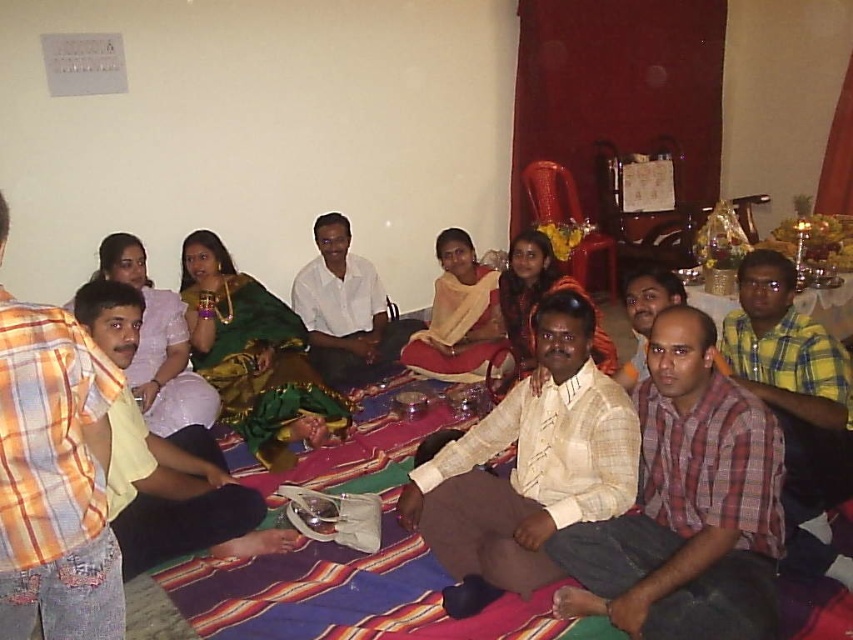
Does yellow plaid shirt at lower right appear over white cotton shirt at center?

Incorrect, yellow plaid shirt at lower right is not positioned above white cotton shirt at center.

Which is in front, point (814, 328) or point (303, 314)?

Point (814, 328) is in front.

The image size is (853, 640). I want to click on yellow plaid shirt at lower right, so click(x=784, y=346).

Who is lower down, yellow plaid shirt at left or matte white cloth at center?

matte white cloth at center

Find the location of `yellow plaid shirt at left`. yellow plaid shirt at left is located at coordinates (178, 497).

The height and width of the screenshot is (640, 853). In order to click on yellow plaid shirt at left in this screenshot , I will do `click(178, 497)`.

Find the location of `yellow plaid shirt at left`. yellow plaid shirt at left is located at coordinates (178, 497).

Between plaid cotton shirt at left and white cotton shirt at center, which one has more height?

white cotton shirt at center is taller.

Can you confirm if plaid cotton shirt at left is thinner than white cotton shirt at center?

Yes, plaid cotton shirt at left is thinner than white cotton shirt at center.

The width and height of the screenshot is (853, 640). In order to click on plaid cotton shirt at left in this screenshot , I will do `click(54, 477)`.

Find the location of `plaid cotton shirt at left`. plaid cotton shirt at left is located at coordinates (54, 477).